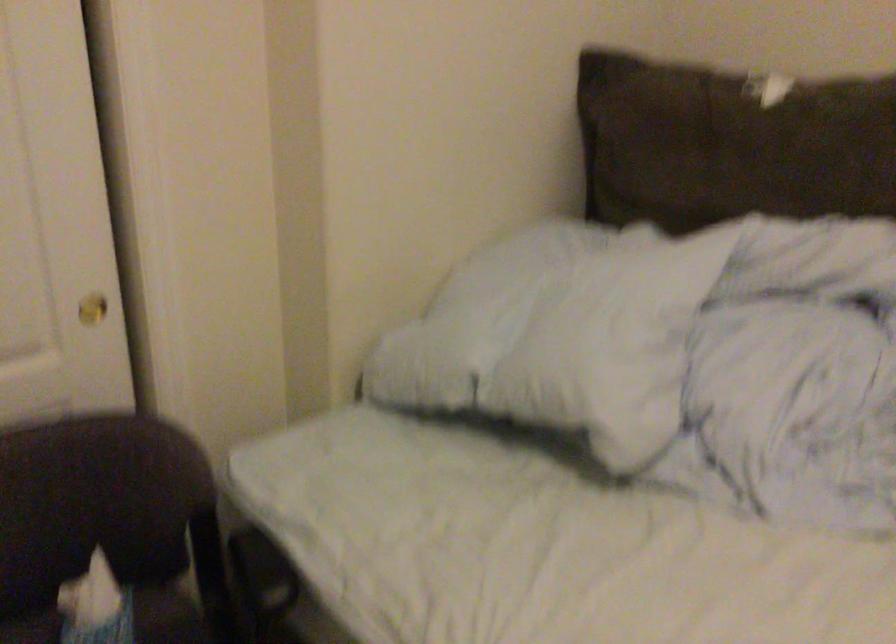
Where would you lift the white pillow? Please return your answer as a coordinate pair (x, y).

(507, 283)